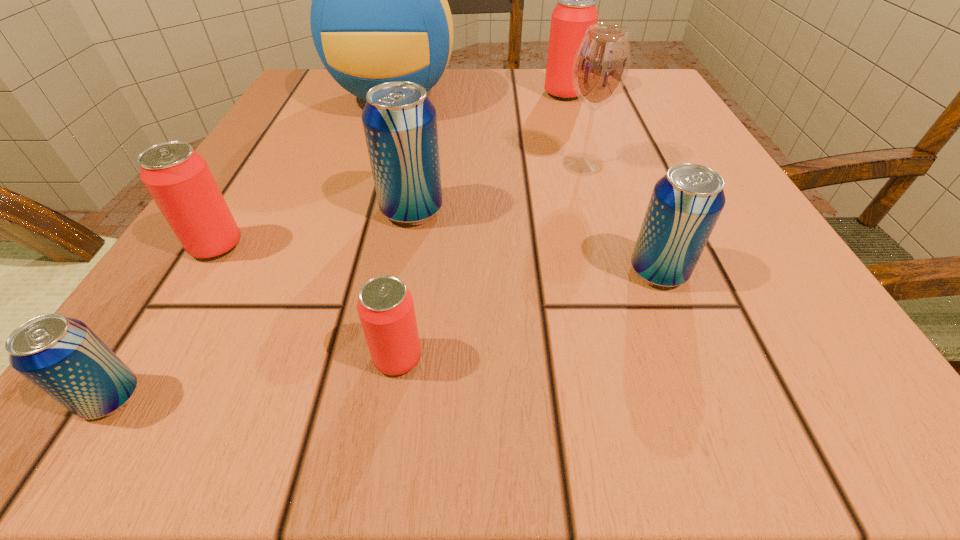
Find the location of a particular element. The image size is (960, 540). free space located 0.330m on the left of the second farthest blue beer can is located at coordinates (354, 272).

Identify the location of vacant space positioned on the right of the leftmost red beer can. This screenshot has width=960, height=540. (328, 246).

Find the location of a particular element. This screenshot has width=960, height=540. vacant space situated 0.060m on the back of the smallest red beer can is located at coordinates (x=407, y=295).

You are a GUI agent. You are given a task and a screenshot of the screen. Output one action in this format:
    pyautogui.click(x=<x>, y=<y>)
    Task: Click on the blank space located 0.170m on the back of the leftmost blue beer can
    
    Given the screenshot: What is the action you would take?
    pyautogui.click(x=202, y=255)

The height and width of the screenshot is (540, 960). I want to click on volleyball present at the far edge, so click(379, 13).

At what (x,y) coordinates should I click in order to perform the action: click on beer can present at the far edge. Please return your answer as a coordinate pair (x, y). Looking at the image, I should click on (576, 10).

At what (x,y) coordinates should I click in order to perform the action: click on volleyball at the left edge. Please return your answer as a coordinate pair (x, y). The height and width of the screenshot is (540, 960). Looking at the image, I should click on (379, 13).

This screenshot has width=960, height=540. What are the coordinates of `object that is at the right edge` in the screenshot? It's located at (685, 204).

Identify the location of object that is positioned at the far left corner. (379, 13).

This screenshot has height=540, width=960. In order to click on object at the near left corner in this screenshot , I will do `click(62, 356)`.